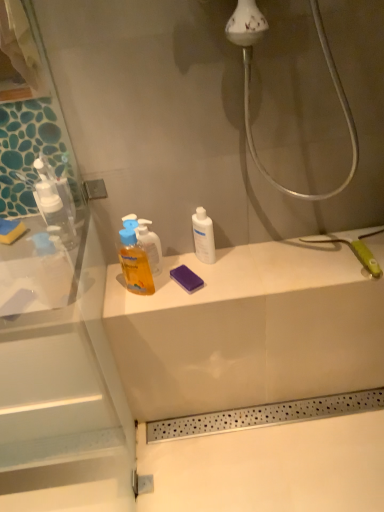
Where is `free space to the left of white matte bottle at center`? This screenshot has height=512, width=384. free space to the left of white matte bottle at center is located at coordinates (157, 275).